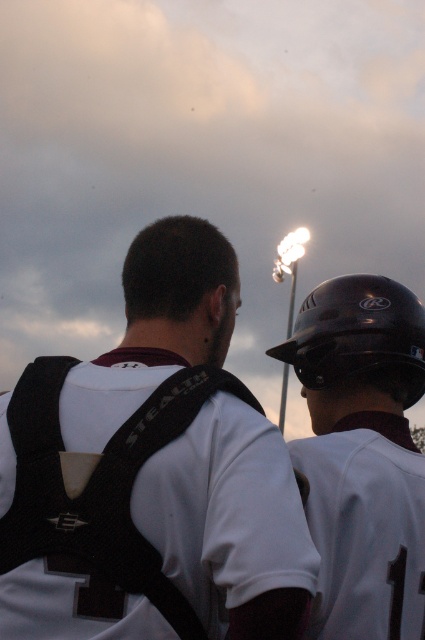
Does matte black helmet at upper right appear on the right side of black matte helmet at upper right?

Incorrect, matte black helmet at upper right is not on the right side of black matte helmet at upper right.

Between matte black helmet at upper right and black matte helmet at upper right, which one has more height?

Standing taller between the two is matte black helmet at upper right.

Identify the location of matte black helmet at upper right. (152, 472).

Find the location of a particular element. matte black helmet at upper right is located at coordinates (152, 472).

Between matte black helmet at upper right and white jersey at upper right, which one has more height?

matte black helmet at upper right is taller.

Can you confirm if matte black helmet at upper right is thinner than white jersey at upper right?

No.

Is point (153, 548) behind point (351, 422)?

No, (153, 548) is closer to viewer.

In order to click on matte black helmet at upper right in this screenshot , I will do `click(152, 472)`.

Is white jersey at upper right smaller than black matte helmet at upper right?

Actually, white jersey at upper right might be larger than black matte helmet at upper right.

What do you see at coordinates (365, 528) in the screenshot?
I see `white jersey at upper right` at bounding box center [365, 528].

Identify the location of white jersey at upper right. (365, 528).